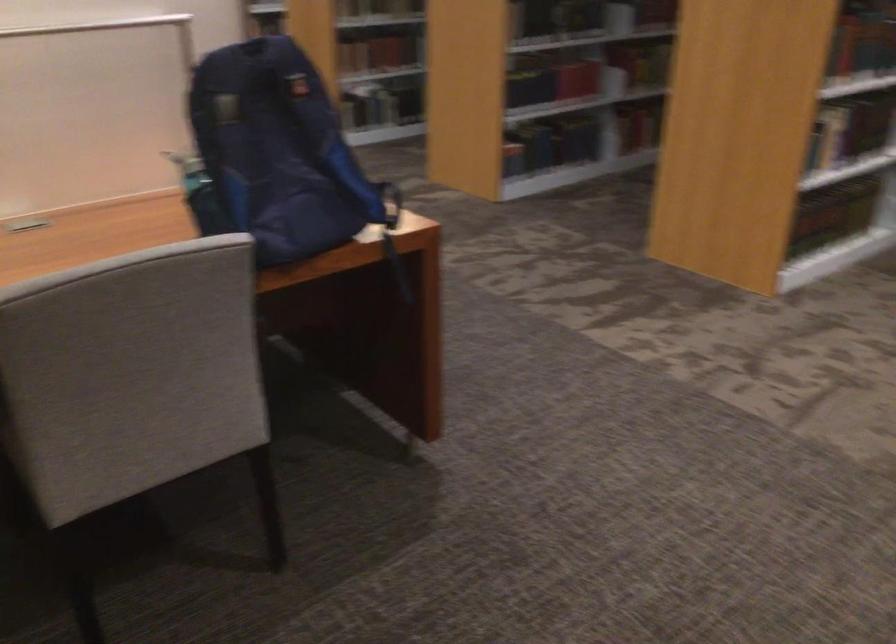
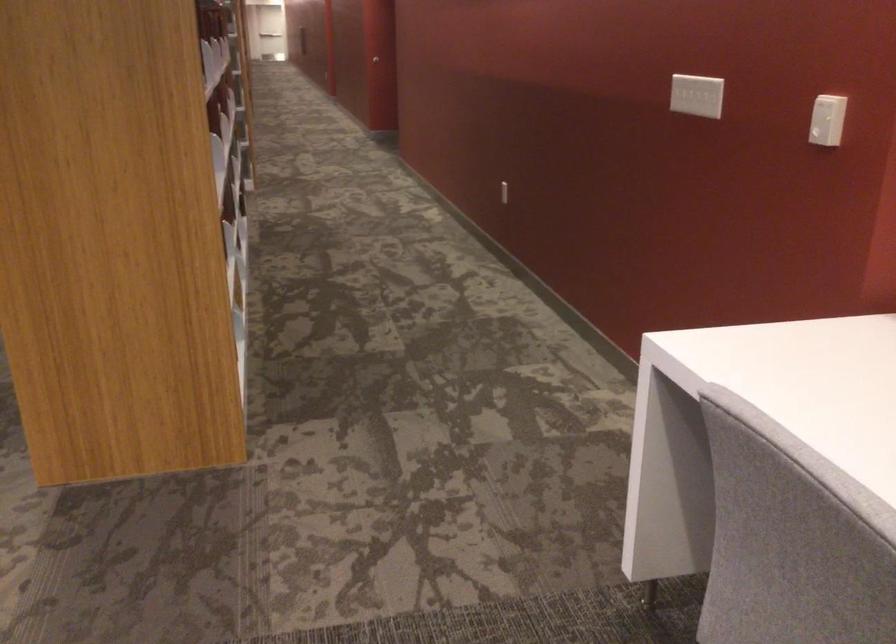
Question: The camera is either moving clockwise (left) or counter-clockwise (right) around the object. The first image is from the beginning of the video and the second image is from the end. Is the camera moving left or right when shooting the video?

Choices:
 (A) Left
 (B) Right

Answer: (A)